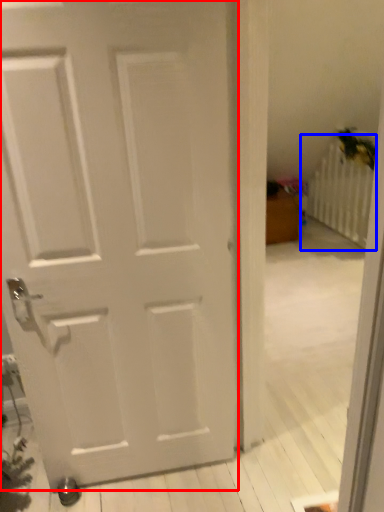
Question: Which object is further to the camera taking this photo, door (highlighted by a red box) or radiator (highlighted by a blue box)?

Choices:
 (A) door
 (B) radiator

Answer: (B)